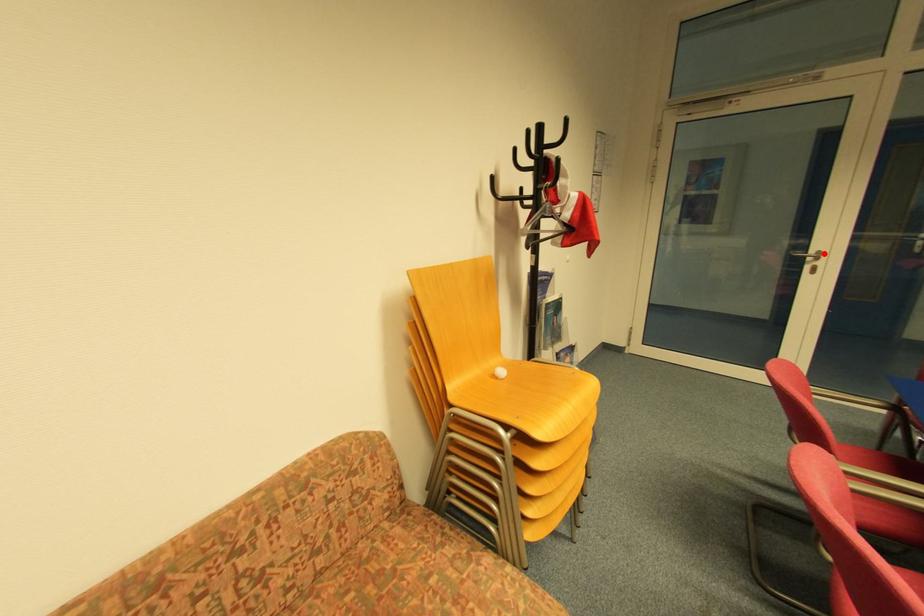
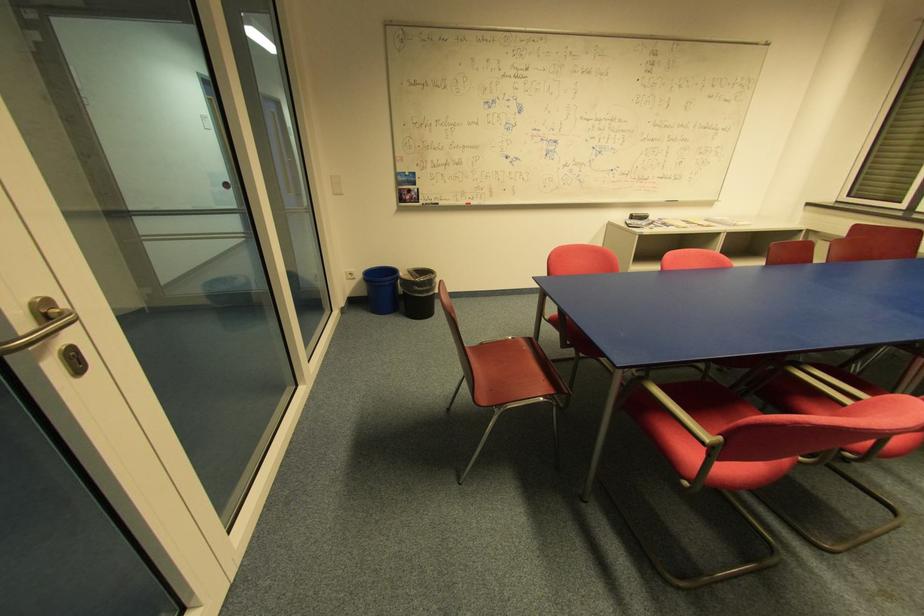
Locate, in the second image, the point that corresponds to the highlighted location in the first image.

(51, 304)